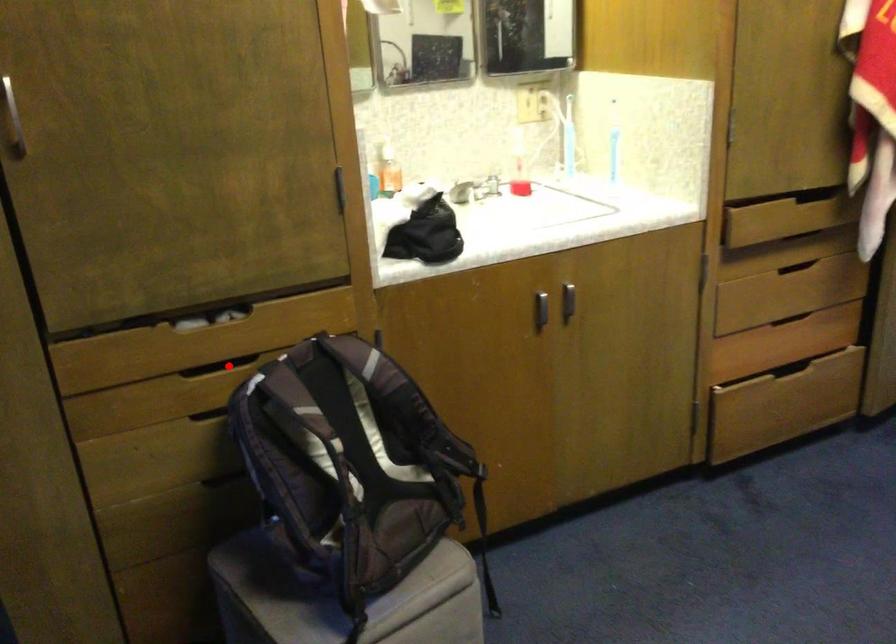
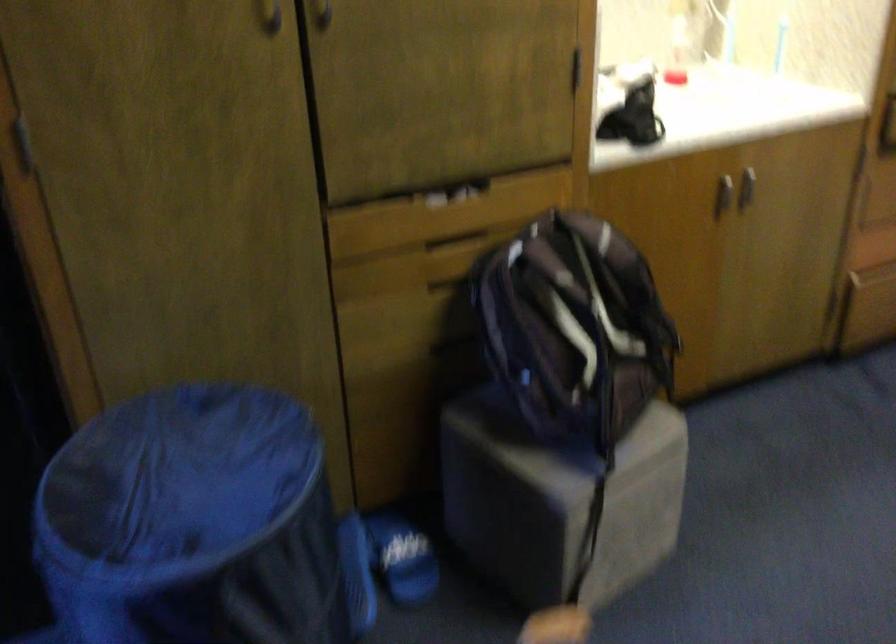
Where in the second image is the point corresponding to the highlighted location from the first image?

(455, 242)